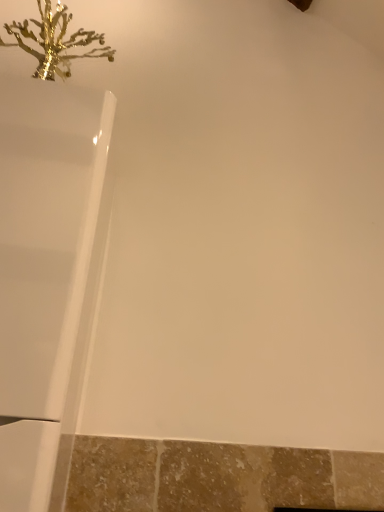
The image size is (384, 512). I want to click on gold metallic coral at upper left, so click(x=55, y=42).

Describe the element at coordinates (55, 42) in the screenshot. I see `gold metallic coral at upper left` at that location.

Image resolution: width=384 pixels, height=512 pixels. What are the coordinates of `white glossy bathtub at upper left` in the screenshot? It's located at (47, 276).

What is the approximate width of white glossy bathtub at upper left?

12.21 inches.

What do you see at coordinates (47, 276) in the screenshot? I see `white glossy bathtub at upper left` at bounding box center [47, 276].

Locate an element on the screen. gold metallic coral at upper left is located at coordinates tap(55, 42).

Is white glossy bathtub at upper left to the right of gold metallic coral at upper left from the viewer's perspective?

Indeed, white glossy bathtub at upper left is positioned on the right side of gold metallic coral at upper left.

Between white glossy bathtub at upper left and gold metallic coral at upper left, which one is positioned behind?

gold metallic coral at upper left.

Is point (95, 147) farther from camera compared to point (97, 34)?

No, it is in front of (97, 34).

From the image's perspective, is white glossy bathtub at upper left located above gold metallic coral at upper left?

Actually, white glossy bathtub at upper left appears below gold metallic coral at upper left in the image.

From a real-world perspective, between white glossy bathtub at upper left and gold metallic coral at upper left, who is vertically lower?

white glossy bathtub at upper left.

In terms of width, does white glossy bathtub at upper left look wider or thinner when compared to gold metallic coral at upper left?

Clearly, white glossy bathtub at upper left has more width compared to gold metallic coral at upper left.

Considering the sizes of objects white glossy bathtub at upper left and gold metallic coral at upper left in the image provided, who is shorter, white glossy bathtub at upper left or gold metallic coral at upper left?

Standing shorter between the two is gold metallic coral at upper left.

Looking at the image, does white glossy bathtub at upper left seem bigger or smaller compared to gold metallic coral at upper left?

Considering their sizes, white glossy bathtub at upper left takes up more space than gold metallic coral at upper left.

Would you say gold metallic coral at upper left is part of white glossy bathtub at upper left's contents?

That's incorrect, gold metallic coral at upper left is not inside white glossy bathtub at upper left.

Is white glossy bathtub at upper left not near gold metallic coral at upper left?

Actually, white glossy bathtub at upper left and gold metallic coral at upper left are a little close together.

Is white glossy bathtub at upper left facing towards gold metallic coral at upper left?

No, white glossy bathtub at upper left is not oriented towards gold metallic coral at upper left.

Locate an element on the screen. bathtub in front of the gold metallic coral at upper left is located at coordinates (47, 276).

In the scene shown: Which is more to the right, gold metallic coral at upper left or white glossy bathtub at upper left?

From the viewer's perspective, white glossy bathtub at upper left appears more on the right side.

Is gold metallic coral at upper left in front of or behind white glossy bathtub at upper left in the image?

gold metallic coral at upper left is behind white glossy bathtub at upper left.

Considering the positions of points (35, 21) and (55, 210), is point (35, 21) closer to camera compared to point (55, 210)?

No.

From the image's perspective, is gold metallic coral at upper left over white glossy bathtub at upper left?

Indeed, from the image's perspective, gold metallic coral at upper left is shown above white glossy bathtub at upper left.

From a real-world perspective, between gold metallic coral at upper left and white glossy bathtub at upper left, who is vertically higher?

gold metallic coral at upper left, from a real-world perspective.

Can you confirm if gold metallic coral at upper left is thinner than white glossy bathtub at upper left?

Yes, gold metallic coral at upper left is thinner than white glossy bathtub at upper left.

Consider the image. Which of these two, gold metallic coral at upper left or white glossy bathtub at upper left, stands taller?

Standing taller between the two is white glossy bathtub at upper left.

Looking at the image, does gold metallic coral at upper left seem bigger or smaller compared to white glossy bathtub at upper left?

Clearly, gold metallic coral at upper left is smaller in size than white glossy bathtub at upper left.

Is white glossy bathtub at upper left a part of gold metallic coral at upper left?

No, gold metallic coral at upper left does not contain white glossy bathtub at upper left.

Is gold metallic coral at upper left not near white glossy bathtub at upper left?

gold metallic coral at upper left is actually quite close to white glossy bathtub at upper left.

Is gold metallic coral at upper left turned away from white glossy bathtub at upper left?

That's not correct — gold metallic coral at upper left is not looking away from white glossy bathtub at upper left.

What's the angular difference between gold metallic coral at upper left and white glossy bathtub at upper left's facing directions?

The angle between the facing direction of gold metallic coral at upper left and the facing direction of white glossy bathtub at upper left is 6.97e-05 degrees.

Identify the location of bathtub beneath the gold metallic coral at upper left (from a real-world perspective). (47, 276).

Image resolution: width=384 pixels, height=512 pixels. Find the location of `christmas decoration behind the white glossy bathtub at upper left`. christmas decoration behind the white glossy bathtub at upper left is located at coordinates (55, 42).

The height and width of the screenshot is (512, 384). I want to click on christmas decoration positioned vertically above the white glossy bathtub at upper left (from a real-world perspective), so click(x=55, y=42).